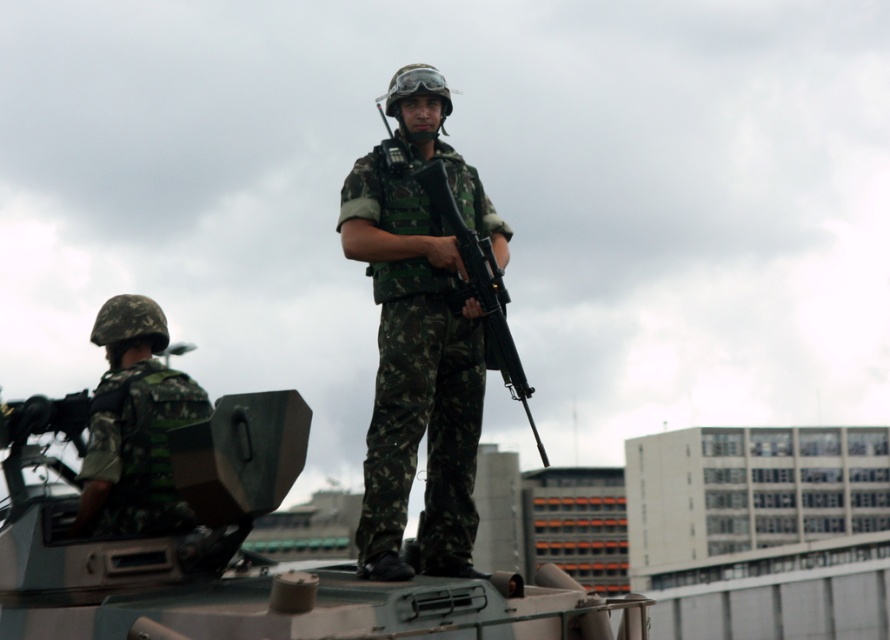
Question: Is camouflage fabric tank at center positioned behind camouflage fabric helmet at left?

Choices:
 (A) yes
 (B) no

Answer: (B)

Question: Is camo uniform at center closer to camera compared to camouflage fabric helmet at left?

Choices:
 (A) yes
 (B) no

Answer: (B)

Question: Considering the real-world distances, which object is closest to the camouflage fabric tank at center?

Choices:
 (A) camouflage fabric helmet at left
 (B) camo uniform at center

Answer: (A)

Question: Which of these objects is positioned closest to the camouflage fabric tank at center?

Choices:
 (A) camo uniform at center
 (B) camouflage fabric helmet at left

Answer: (B)

Question: Where is camouflage fabric tank at center located in relation to camouflage fabric helmet at left in the image?

Choices:
 (A) left
 (B) right

Answer: (B)

Question: Which of the following is the farthest from the observer?

Choices:
 (A) camo uniform at center
 (B) camouflage fabric helmet at left

Answer: (A)